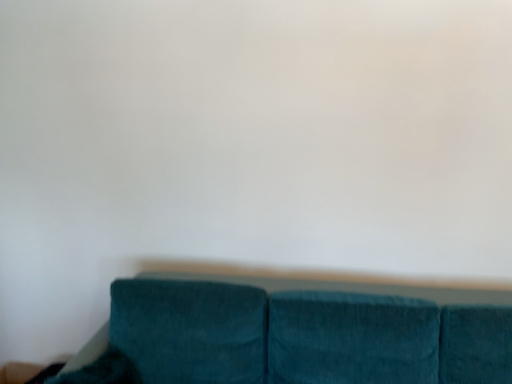
Image resolution: width=512 pixels, height=384 pixels. What do you see at coordinates (300, 331) in the screenshot?
I see `velvet teal couch at lower center` at bounding box center [300, 331].

The height and width of the screenshot is (384, 512). I want to click on velvet teal couch at lower center, so click(300, 331).

Identify the location of velvet teal couch at lower center. The height and width of the screenshot is (384, 512). (300, 331).